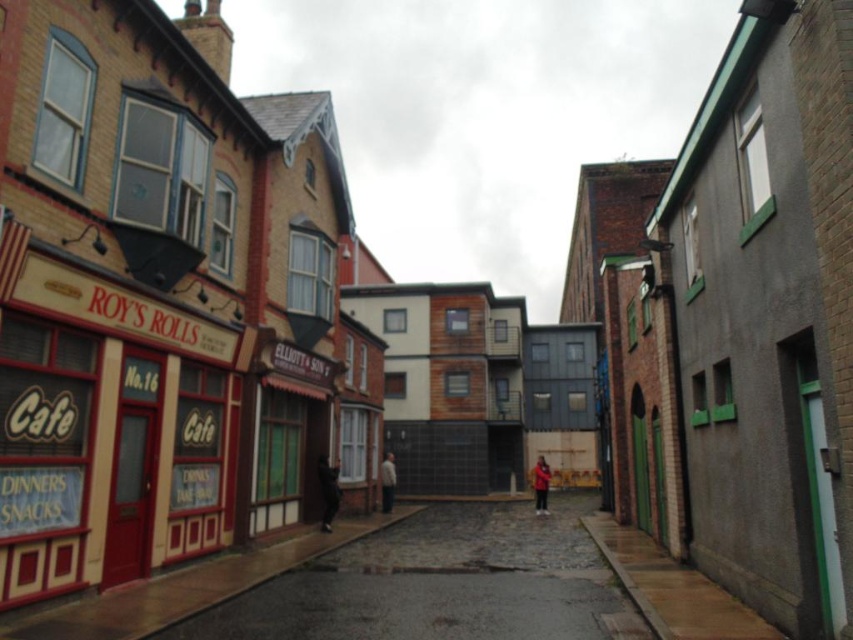
Question: Which object is the farthest from the white matte jacket at center?

Choices:
 (A) red fabric coat at center
 (B) dark gray fabric jacket at center

Answer: (B)

Question: Which is farther from the dark gray fabric jacket at center?

Choices:
 (A) white matte jacket at center
 (B) red fabric coat at center

Answer: (B)

Question: Which object is closer to the camera taking this photo?

Choices:
 (A) red fabric coat at center
 (B) white matte jacket at center
 (C) dark gray fabric jacket at center

Answer: (C)

Question: From the image, what is the correct spatial relationship of red fabric coat at center in relation to white matte jacket at center?

Choices:
 (A) above
 (B) below

Answer: (B)

Question: Can you confirm if dark gray fabric jacket at center is positioned above red fabric coat at center?

Choices:
 (A) no
 (B) yes

Answer: (B)

Question: Does dark gray fabric jacket at center appear over white matte jacket at center?

Choices:
 (A) yes
 (B) no

Answer: (A)